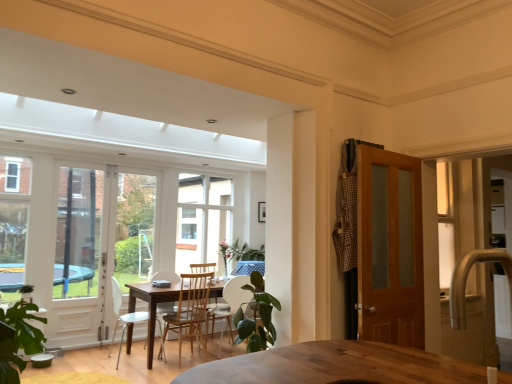
Question: Is metallic silver table at center wider than white glass window at center?

Choices:
 (A) yes
 (B) no

Answer: (B)

Question: From the image's perspective, is metallic silver table at center above white glass window at center?

Choices:
 (A) yes
 (B) no

Answer: (B)

Question: Does metallic silver table at center touch white glass window at center?

Choices:
 (A) no
 (B) yes

Answer: (A)

Question: Does metallic silver table at center have a lesser height compared to white glass window at center?

Choices:
 (A) no
 (B) yes

Answer: (B)

Question: Could you tell me if metallic silver table at center is turned towards white glass window at center?

Choices:
 (A) no
 (B) yes

Answer: (A)

Question: From a real-world perspective, is green leafy plant at center positioned above or below gold textured faucet at right?

Choices:
 (A) below
 (B) above

Answer: (A)

Question: In the image, is green leafy plant at center on the left side or the right side of gold textured faucet at right?

Choices:
 (A) right
 (B) left

Answer: (B)

Question: Relative to gold textured faucet at right, is green leafy plant at center in front or behind?

Choices:
 (A) behind
 (B) front

Answer: (A)

Question: Is green leafy plant at center wider or thinner than gold textured faucet at right?

Choices:
 (A) thin
 (B) wide

Answer: (B)

Question: In the image, is wooden chair at center, marked as the 2th chair in a right-to-left arrangement, on the left side or the right side of green leafy plant at center?

Choices:
 (A) left
 (B) right

Answer: (A)

Question: From the image's perspective, relative to green leafy plant at center, is wooden chair at center, which appears as the 2th chair when viewed from the left, above or below?

Choices:
 (A) above
 (B) below

Answer: (B)

Question: Relative to green leafy plant at center, is wooden chair at center, which appears as the 2th chair when viewed from the left, in front or behind?

Choices:
 (A) behind
 (B) front

Answer: (A)

Question: From their relative heights in the image, would you say wooden chair at center, marked as the 2th chair in a right-to-left arrangement, is taller or shorter than green leafy plant at center?

Choices:
 (A) short
 (B) tall

Answer: (B)

Question: From a real-world perspective, relative to white glass window at center, is wooden chair at center, the third chair when ordered from left to right, vertically above or below?

Choices:
 (A) above
 (B) below

Answer: (B)

Question: From the image's perspective, is wooden chair at center, marked as the 1th chair in a right-to-left arrangement, positioned above or below white glass window at center?

Choices:
 (A) above
 (B) below

Answer: (B)